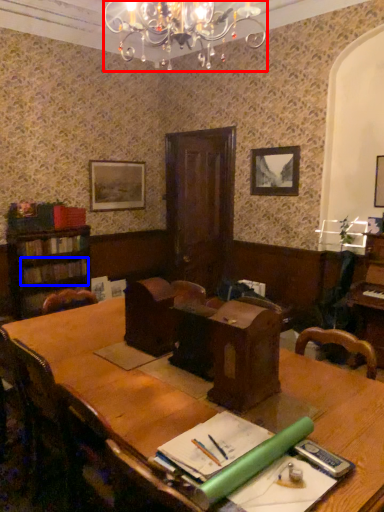
Question: Which point is further to the camera, light fixture (highlighted by a red box) or book (highlighted by a blue box)?

Choices:
 (A) light fixture
 (B) book

Answer: (B)